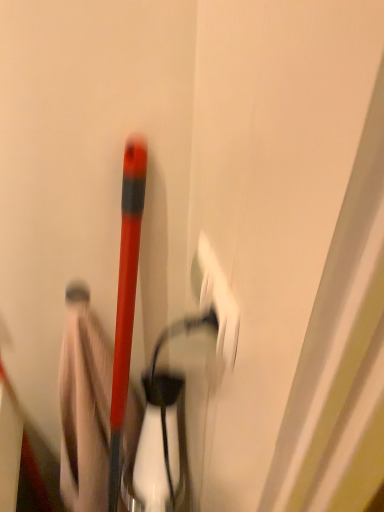
Image resolution: width=384 pixels, height=512 pixels. Describe the element at coordinates (84, 405) in the screenshot. I see `light beige fabric at center` at that location.

Find the location of a particular element. The width and height of the screenshot is (384, 512). light beige fabric at center is located at coordinates (84, 405).

The image size is (384, 512). I want to click on light beige fabric at center, so click(84, 405).